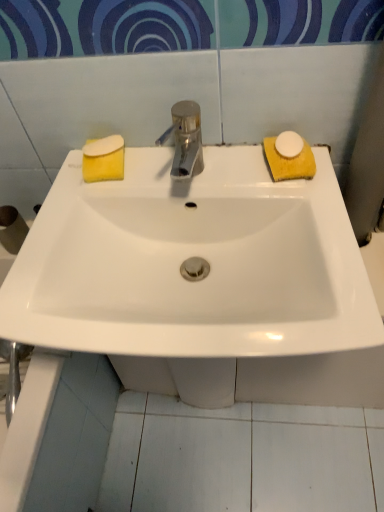
What are the coordinates of `empty space that is in between yellow sponge at left, the 1th soap in the left-to-right sequence, and polished metallic tap at center` in the screenshot? It's located at (143, 174).